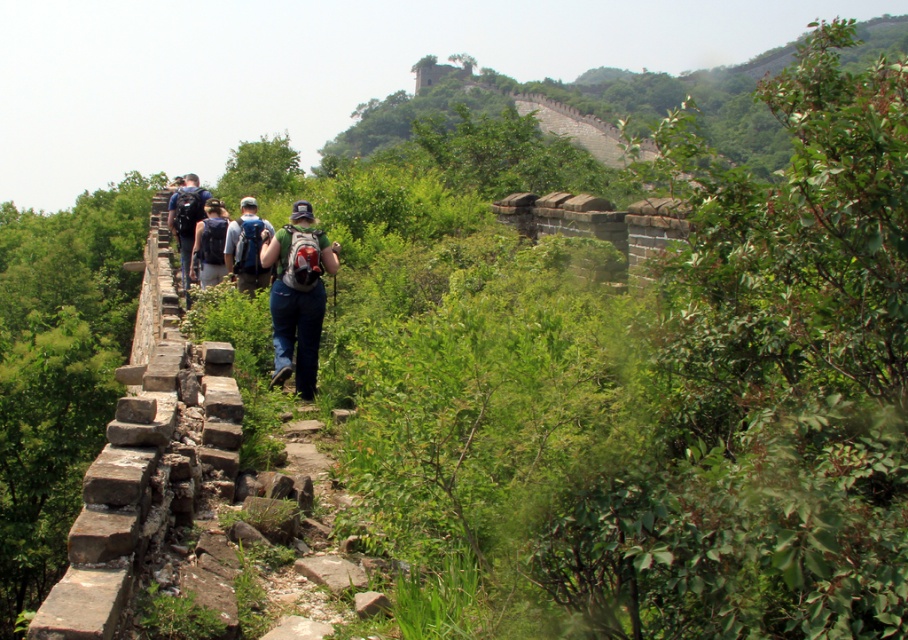
Is matte gray backpack at center wider than dark blue backpack at center?

No, matte gray backpack at center is not wider than dark blue backpack at center.

Is point (235, 262) closer to camera compared to point (216, 259)?

Yes, point (235, 262) is closer to viewer.

Where is `matte gray backpack at center`? The width and height of the screenshot is (908, 640). matte gray backpack at center is located at coordinates (245, 248).

Measure the distance between denim jeans at center and camera.

denim jeans at center is 28.29 feet away from camera.

You are a GUI agent. You are given a task and a screenshot of the screen. Output one action in this format:
    pyautogui.click(x=<x>, y=<y>)
    Task: Click on the denim jeans at center
    
    Given the screenshot: What is the action you would take?
    pyautogui.click(x=297, y=294)

What do you see at coordinates (297, 294) in the screenshot?
I see `denim jeans at center` at bounding box center [297, 294].

The width and height of the screenshot is (908, 640). I want to click on denim jeans at center, so click(297, 294).

Does point (206, 264) lie in front of point (195, 196)?

Yes, it is.

Is dark blue backpack at center below dark blue jeans at center?

Indeed, dark blue backpack at center is positioned under dark blue jeans at center.

Describe the element at coordinates (209, 244) in the screenshot. Image resolution: width=908 pixels, height=640 pixels. I see `dark blue backpack at center` at that location.

Where is `dark blue backpack at center`? The image size is (908, 640). dark blue backpack at center is located at coordinates (209, 244).